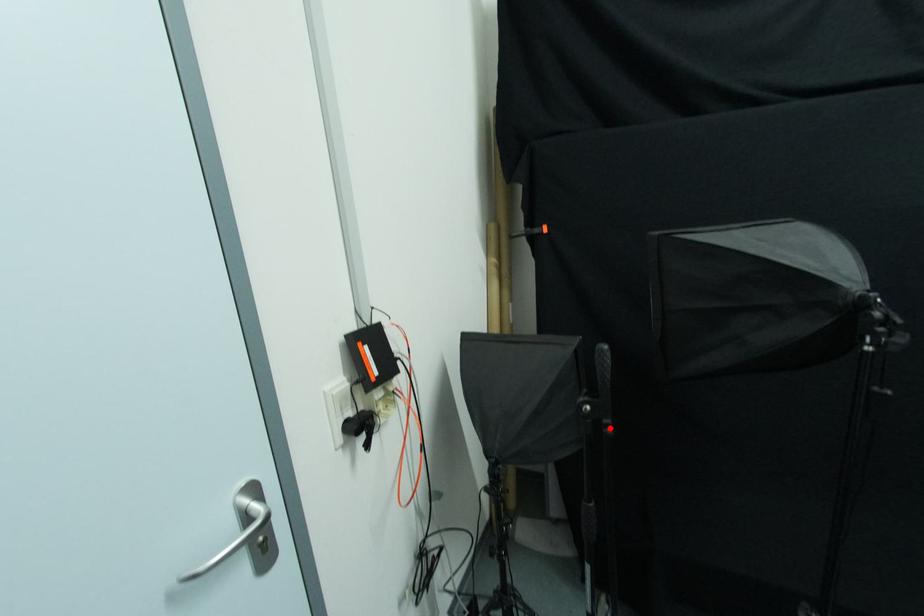
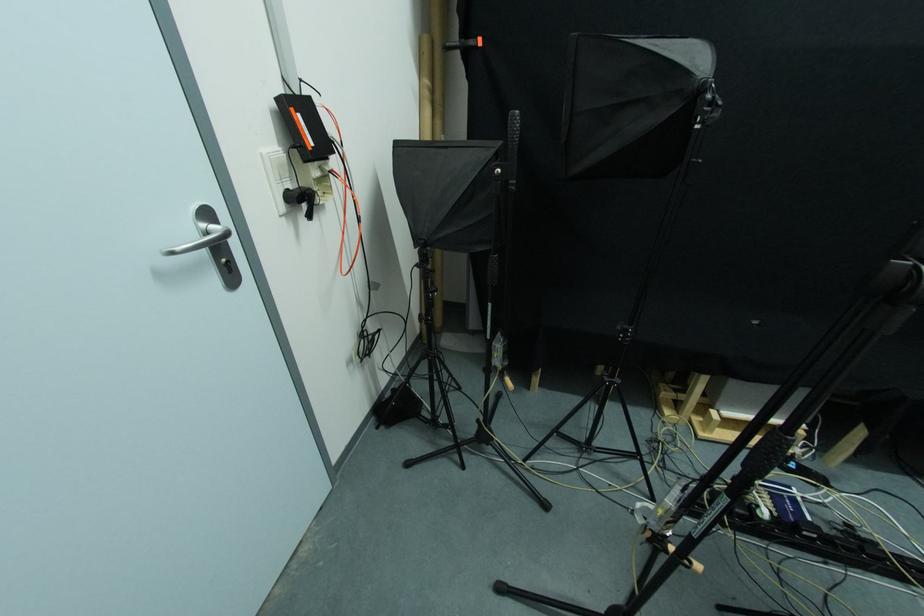
Where in the second image is the point corresponding to the highlighted location from the first image?

(515, 187)